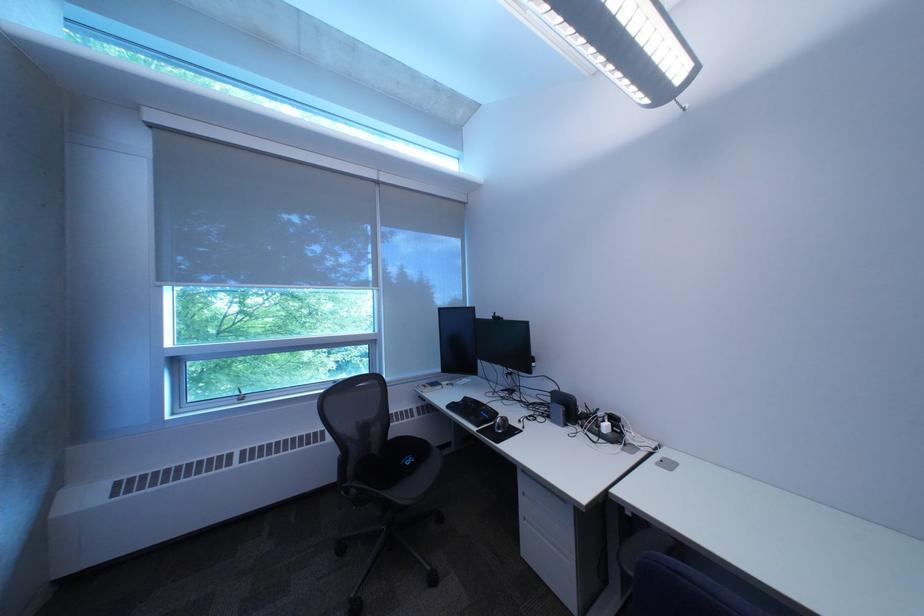
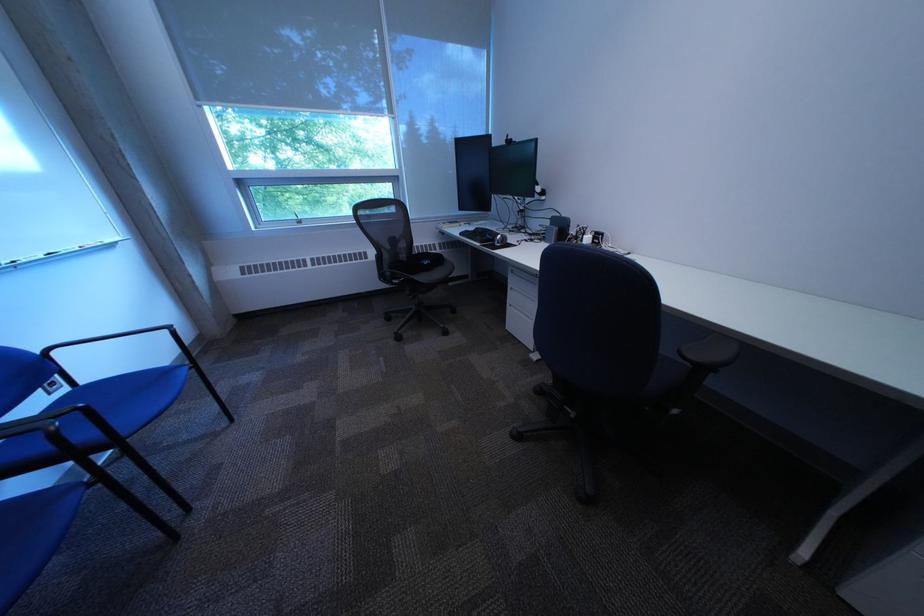
Which direction would the cameraman need to move to produce the second image?

The movement direction of the cameraman is right, backward.